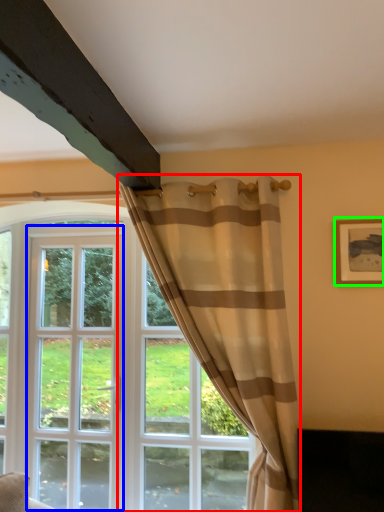
Question: Based on their relative distances, which object is nearer to curtain (highlighted by a red box)? Choose from screen door (highlighted by a blue box) and picture frame (highlighted by a green box).

Choices:
 (A) screen door
 (B) picture frame

Answer: (B)